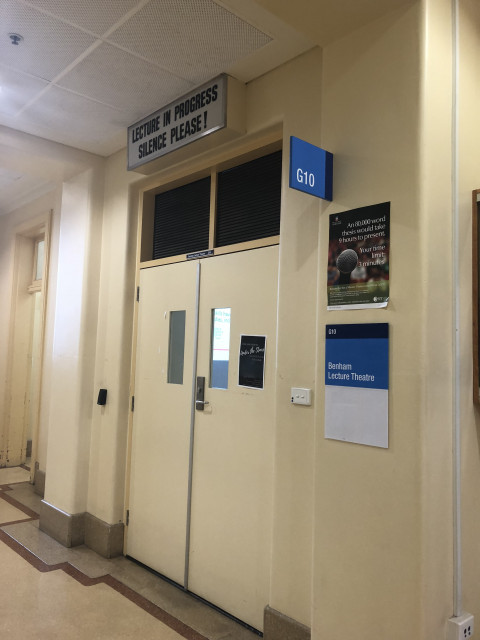
The height and width of the screenshot is (640, 480). Find the location of `baseboards`. baseboards is located at coordinates (111, 532), (58, 528), (40, 484), (274, 623).